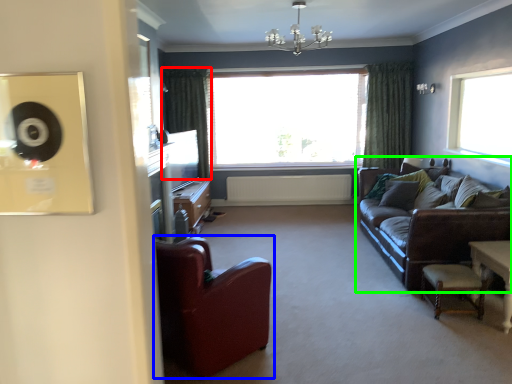
Question: Considering the real-world distances, which object is closest to curtain (highlighted by a red box)? chair (highlighted by a blue box) or studio couch (highlighted by a green box).

Choices:
 (A) chair
 (B) studio couch

Answer: (B)